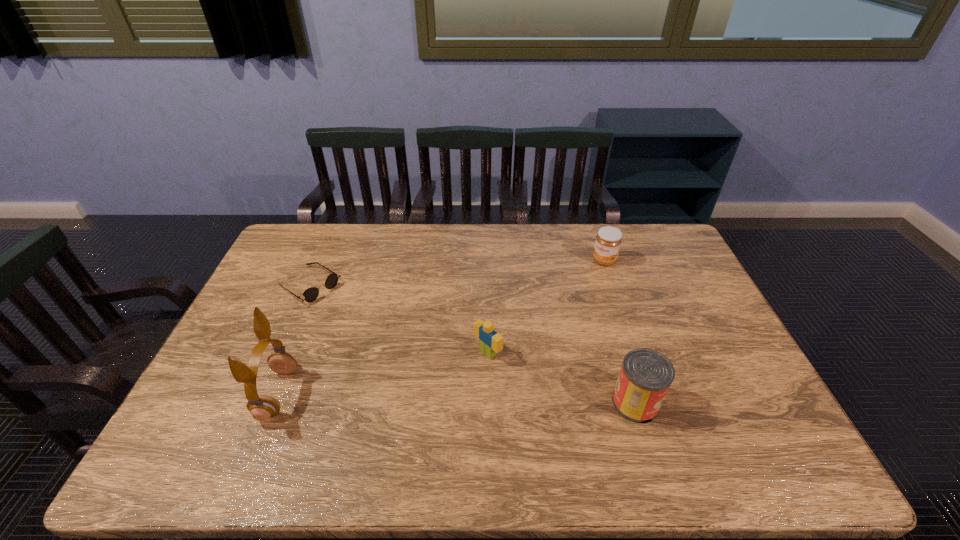
Locate an element on the screen. The image size is (960, 540). earphone is located at coordinates 262,407.

Where is `can`? The height and width of the screenshot is (540, 960). can is located at coordinates (646, 375).

You are a GUI agent. You are given a task and a screenshot of the screen. Output one action in this format:
    pyautogui.click(x=<x>, y=<y>)
    Task: Click on the third object from right to left
    This screenshot has width=960, height=540.
    Given the screenshot: What is the action you would take?
    pyautogui.click(x=490, y=342)

The height and width of the screenshot is (540, 960). In order to click on jam in this screenshot , I will do `click(608, 240)`.

Identify the location of the shortest object. (311, 294).

Image resolution: width=960 pixels, height=540 pixels. What are the coordinates of `free location located 0.150m on the front-facing side of the earphone` in the screenshot? It's located at (205, 393).

Where is `vacant region located 0.070m on the front-facing side of the earphone`? Image resolution: width=960 pixels, height=540 pixels. vacant region located 0.070m on the front-facing side of the earphone is located at coordinates (236, 393).

This screenshot has height=540, width=960. I want to click on vacant position located on the front-facing side of the earphone, so click(x=205, y=393).

You are a GUI agent. You are given a task and a screenshot of the screen. Output one action in this format:
    pyautogui.click(x=<x>, y=<y>)
    Task: Click on the free space located on the left of the can
    
    Given the screenshot: What is the action you would take?
    pyautogui.click(x=506, y=403)

This screenshot has width=960, height=540. What are the coordinates of `vacant area situated on the face of the third object from left to right` in the screenshot? It's located at (411, 411).